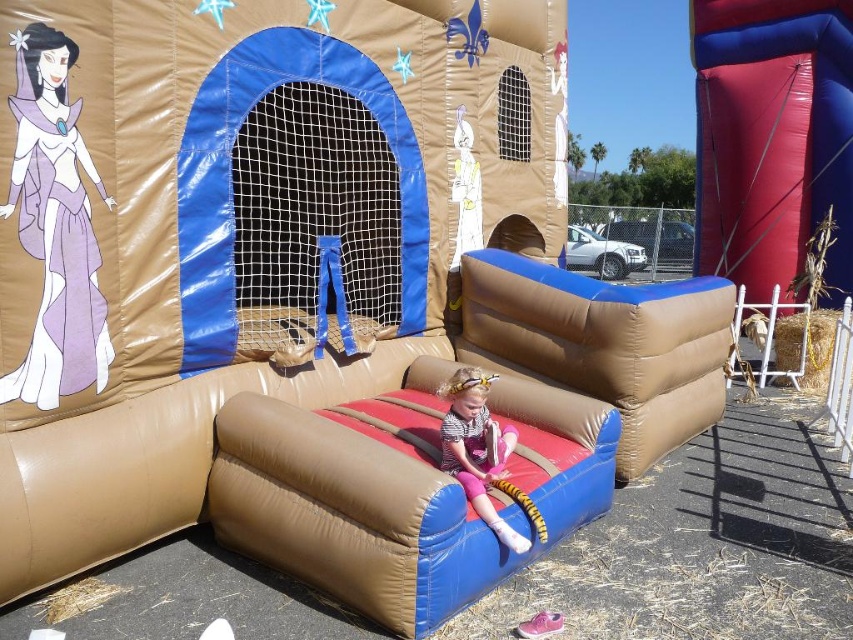
Is smooth red slide at right positioned in front of purple satin dress at upper left?

No, it is behind purple satin dress at upper left.

Can you confirm if smooth red slide at right is positioned above purple satin dress at upper left?

Indeed, smooth red slide at right is positioned over purple satin dress at upper left.

Who is more distant from viewer, (792,112) or (24,209)?

The point (792,112) is more distant.

Where is `smooth red slide at right`? smooth red slide at right is located at coordinates (770, 138).

Does smooth red slide at right appear under matte pink leggings at center?

Actually, smooth red slide at right is above matte pink leggings at center.

Does smooth red slide at right have a smaller size compared to matte pink leggings at center?

Incorrect, smooth red slide at right is not smaller in size than matte pink leggings at center.

The width and height of the screenshot is (853, 640). Describe the element at coordinates (770, 138) in the screenshot. I see `smooth red slide at right` at that location.

Locate an element on the screen. The height and width of the screenshot is (640, 853). smooth red slide at right is located at coordinates (770, 138).

Can you confirm if purple satin dress at upper left is taller than matte pink leggings at center?

Yes, purple satin dress at upper left is taller than matte pink leggings at center.

This screenshot has width=853, height=640. I want to click on purple satin dress at upper left, so [55, 227].

I want to click on purple satin dress at upper left, so click(x=55, y=227).